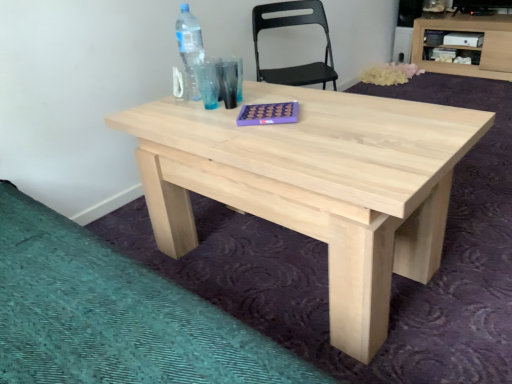
Question: From the image's perspective, is light wood/unfinished wood computer desk at upper right under natural wood table at center?

Choices:
 (A) yes
 (B) no

Answer: (B)

Question: From a real-world perspective, is light wood/unfinished wood computer desk at upper right beneath natural wood table at center?

Choices:
 (A) no
 (B) yes

Answer: (A)

Question: Is light wood/unfinished wood computer desk at upper right looking in the opposite direction of natural wood table at center?

Choices:
 (A) no
 (B) yes

Answer: (A)

Question: Is natural wood table at center completely or partially inside light wood/unfinished wood computer desk at upper right?

Choices:
 (A) no
 (B) yes

Answer: (A)

Question: From the image's perspective, does light wood/unfinished wood computer desk at upper right appear higher than natural wood table at center?

Choices:
 (A) yes
 (B) no

Answer: (A)

Question: Does light wood/unfinished wood computer desk at upper right have a lesser height compared to natural wood table at center?

Choices:
 (A) yes
 (B) no

Answer: (B)

Question: Is natural wood table at center behind black plastic chair at upper center?

Choices:
 (A) no
 (B) yes

Answer: (A)

Question: Is natural wood table at center positioned with its back to black plastic chair at upper center?

Choices:
 (A) no
 (B) yes

Answer: (A)

Question: From a real-world perspective, is natural wood table at center physically above black plastic chair at upper center?

Choices:
 (A) no
 (B) yes

Answer: (A)

Question: Is natural wood table at center in front of black plastic chair at upper center?

Choices:
 (A) yes
 (B) no

Answer: (A)

Question: From the image's perspective, would you say natural wood table at center is shown under black plastic chair at upper center?

Choices:
 (A) yes
 (B) no

Answer: (A)

Question: Does natural wood table at center turn towards black plastic chair at upper center?

Choices:
 (A) yes
 (B) no

Answer: (B)

Question: From the image's perspective, is transparent plastic bottle at upper left under black plastic chair at upper center?

Choices:
 (A) yes
 (B) no

Answer: (A)